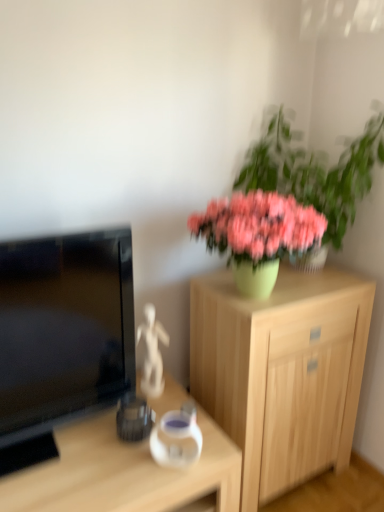
Question: Would you say matte black television at left is outside green matte vase at upper right?

Choices:
 (A) no
 (B) yes

Answer: (B)

Question: Would you say matte black television at left contains green matte vase at upper right?

Choices:
 (A) no
 (B) yes

Answer: (A)

Question: Can you confirm if matte black television at left is bigger than green matte vase at upper right?

Choices:
 (A) no
 (B) yes

Answer: (A)

Question: Does matte black television at left appear on the left side of green matte vase at upper right?

Choices:
 (A) yes
 (B) no

Answer: (A)

Question: Could you tell me if matte black television at left is turned towards green matte vase at upper right?

Choices:
 (A) yes
 (B) no

Answer: (B)

Question: In terms of width, does light wood cabinet at center look wider or thinner when compared to matte black television at left?

Choices:
 (A) thin
 (B) wide

Answer: (B)

Question: Is light wood cabinet at center inside or outside of matte black television at left?

Choices:
 (A) inside
 (B) outside

Answer: (B)

Question: Considering their positions, is light wood cabinet at center located in front of or behind matte black television at left?

Choices:
 (A) behind
 (B) front

Answer: (A)

Question: Is light wood cabinet at center bigger or smaller than matte black television at left?

Choices:
 (A) small
 (B) big

Answer: (B)

Question: Is point (168, 417) positioned closer to the camera than point (102, 312)?

Choices:
 (A) farther
 (B) closer

Answer: (A)

Question: Based on their sizes in the image, would you say transparent glass vase at center is bigger or smaller than matte black television at left?

Choices:
 (A) big
 (B) small

Answer: (B)

Question: Is transparent glass vase at center taller or shorter than matte black television at left?

Choices:
 (A) short
 (B) tall

Answer: (A)

Question: Is transparent glass vase at center to the left or to the right of matte black television at left in the image?

Choices:
 (A) right
 (B) left

Answer: (A)

Question: Looking at their shapes, would you say transparent glass vase at center is wider or thinner than light wood cabinet at center?

Choices:
 (A) thin
 (B) wide

Answer: (A)

Question: In the image, is transparent glass vase at center positioned in front of or behind light wood cabinet at center?

Choices:
 (A) front
 (B) behind

Answer: (A)